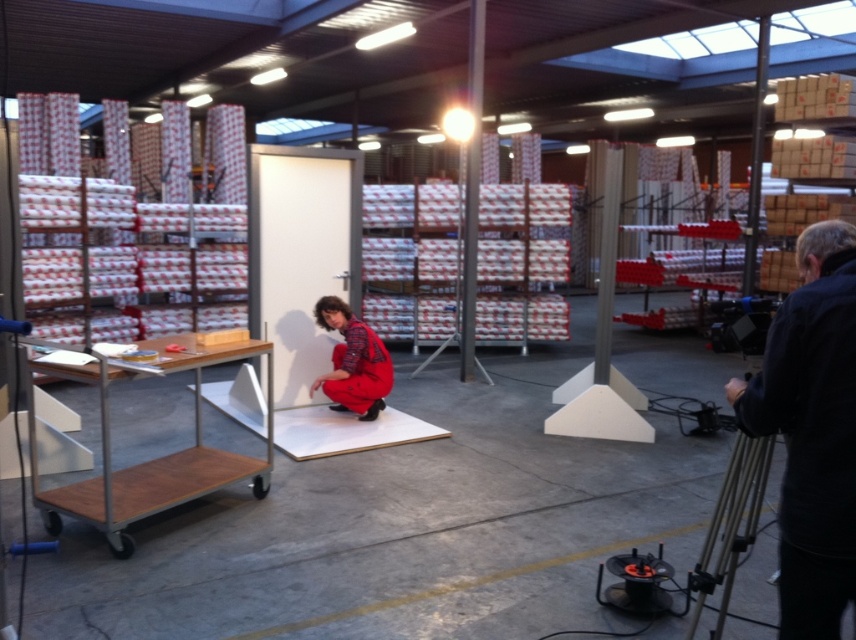
You are an inspector in the warehouse and need to move the black fabric at right and the brown wooden trolley at left to a new storage area. Based on their sizes, which item will require more space when moving?

The brown wooden trolley at left requires more space when moving because it occupies more space than the black fabric at right according to the description.

You are a warehouse worker who needs to move the brown wooden trolley at left and the red plaid jumpsuit at center to a different storage area. If the storage area has a 1.2 meter wide doorway, will both items fit through the doorway when moved individually?

The brown wooden trolley at left is bigger than the red plaid jumpsuit at center. However, the exact dimensions of each item are not provided. Without knowing their specific sizes, it is impossible to determine if they will fit through the 1.2 meter wide doorway. Additional measurements are required to make an accurate assessment.

You are navigating a warehouse and need to move from point A to point B. Point A is at coordinates point [79,499] and point B is at coordinates point [391,378]. According to the image, which point is closer to the person in red overalls?

Point [79,499] is closer to the person in red overalls because it is in front of point [391,378].